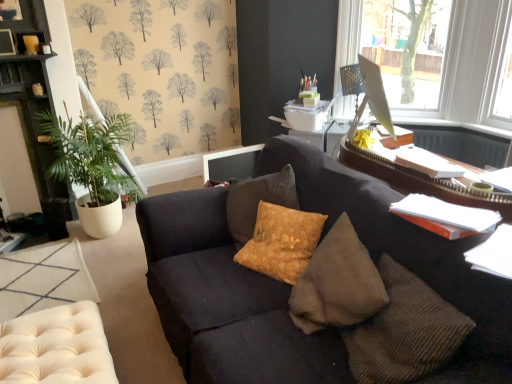
Question: From a real-world perspective, is metallic mesh table lamp at upper right located higher than beige tufted ottoman at lower left?

Choices:
 (A) no
 (B) yes

Answer: (B)

Question: Is metallic mesh table lamp at upper right oriented away from beige tufted ottoman at lower left?

Choices:
 (A) yes
 (B) no

Answer: (B)

Question: Is the position of metallic mesh table lamp at upper right less distant than that of beige tufted ottoman at lower left?

Choices:
 (A) yes
 (B) no

Answer: (B)

Question: Is metallic mesh table lamp at upper right with beige tufted ottoman at lower left?

Choices:
 (A) no
 (B) yes

Answer: (A)

Question: Does metallic mesh table lamp at upper right appear on the left side of beige tufted ottoman at lower left?

Choices:
 (A) no
 (B) yes

Answer: (A)

Question: Is green leafy plant at left inside or outside of dark gray fabric couch at center?

Choices:
 (A) outside
 (B) inside

Answer: (A)

Question: Is green leafy plant at left wider or thinner than dark gray fabric couch at center?

Choices:
 (A) wide
 (B) thin

Answer: (B)

Question: From the image's perspective, is green leafy plant at left above or below dark gray fabric couch at center?

Choices:
 (A) below
 (B) above

Answer: (B)

Question: Based on their sizes in the image, would you say green leafy plant at left is bigger or smaller than dark gray fabric couch at center?

Choices:
 (A) big
 (B) small

Answer: (B)

Question: From the image's perspective, relative to green leafy plant at left, is suede textured pillow at center above or below?

Choices:
 (A) above
 (B) below

Answer: (B)

Question: From a real-world perspective, is suede textured pillow at center physically located above or below green leafy plant at left?

Choices:
 (A) below
 (B) above

Answer: (B)

Question: Visually, is suede textured pillow at center positioned to the left or to the right of green leafy plant at left?

Choices:
 (A) right
 (B) left

Answer: (A)

Question: Choose the correct answer: Is suede textured pillow at center inside green leafy plant at left or outside it?

Choices:
 (A) outside
 (B) inside

Answer: (A)

Question: Is transparent glass monitor at upper right taller or shorter than matte cream tufted swivel chair at lower left?

Choices:
 (A) tall
 (B) short

Answer: (A)

Question: From a real-world perspective, is transparent glass monitor at upper right above or below matte cream tufted swivel chair at lower left?

Choices:
 (A) above
 (B) below

Answer: (A)